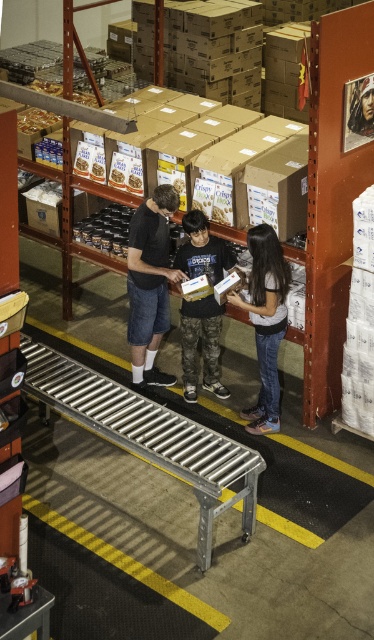
Question: Does denim shorts at center appear on the left side of smooth leather jacket at upper center?

Choices:
 (A) no
 (B) yes

Answer: (B)

Question: Which object appears farthest from the camera in this image?

Choices:
 (A) smooth leather jacket at upper center
 (B) camouflage pants at center
 (C) denim shorts at center
 (D) denim jeans at center

Answer: (B)

Question: Does denim shorts at center have a larger size compared to smooth leather jacket at upper center?

Choices:
 (A) no
 (B) yes

Answer: (B)

Question: Is denim shorts at center in front of smooth leather jacket at upper center?

Choices:
 (A) no
 (B) yes

Answer: (A)

Question: Which point is closer to the camera?

Choices:
 (A) (185, 380)
 (B) (142, 342)

Answer: (B)

Question: Which point is closer to the camera?

Choices:
 (A) camouflage pants at center
 (B) denim shorts at center
 (C) smooth leather jacket at upper center
 (D) denim jeans at center

Answer: (C)